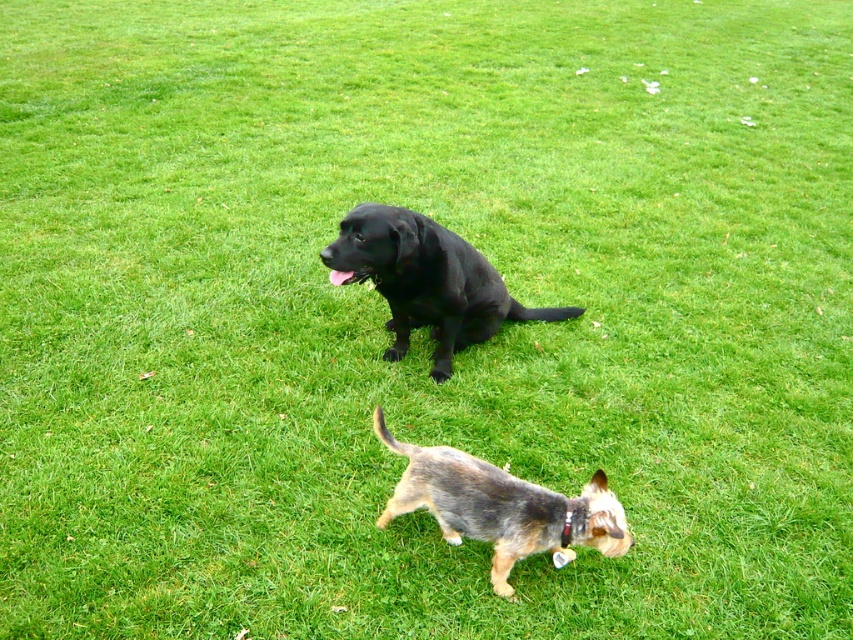
Who is lower down, black matte dog at center or spotted fur dog at center?

spotted fur dog at center

Does point (480, 308) come in front of point (497, 483)?

No.

Identify the location of black matte dog at center. (426, 280).